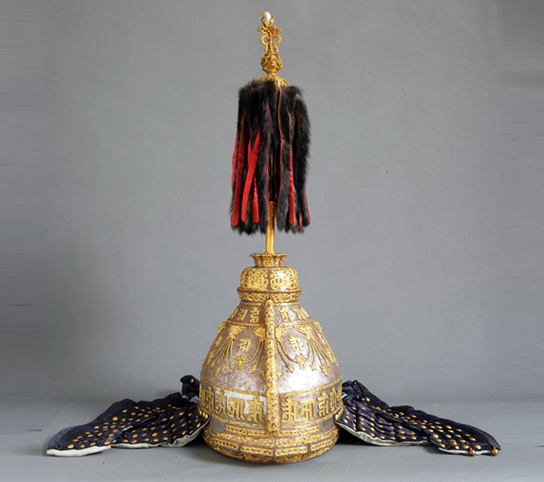
This screenshot has height=482, width=544. I want to click on vase, so (307, 345).